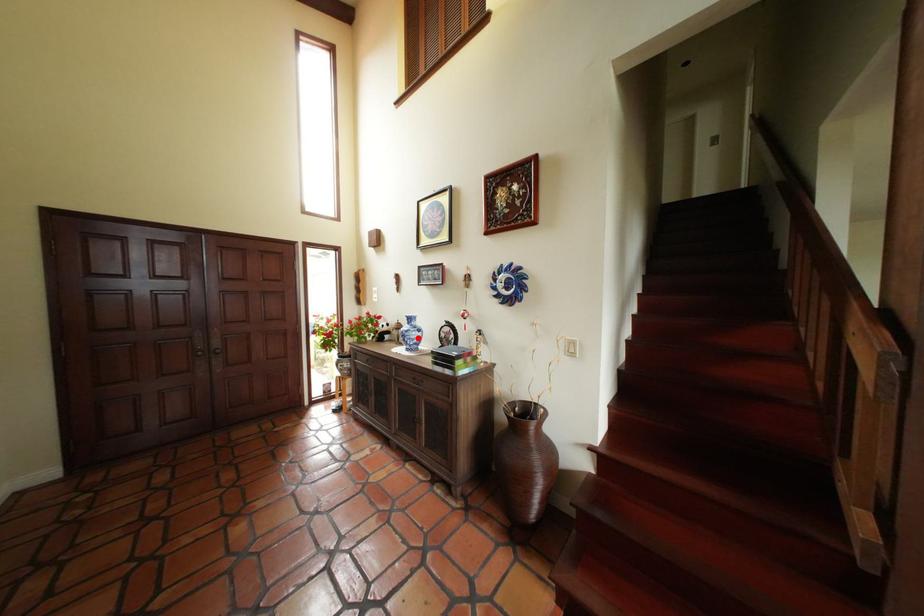
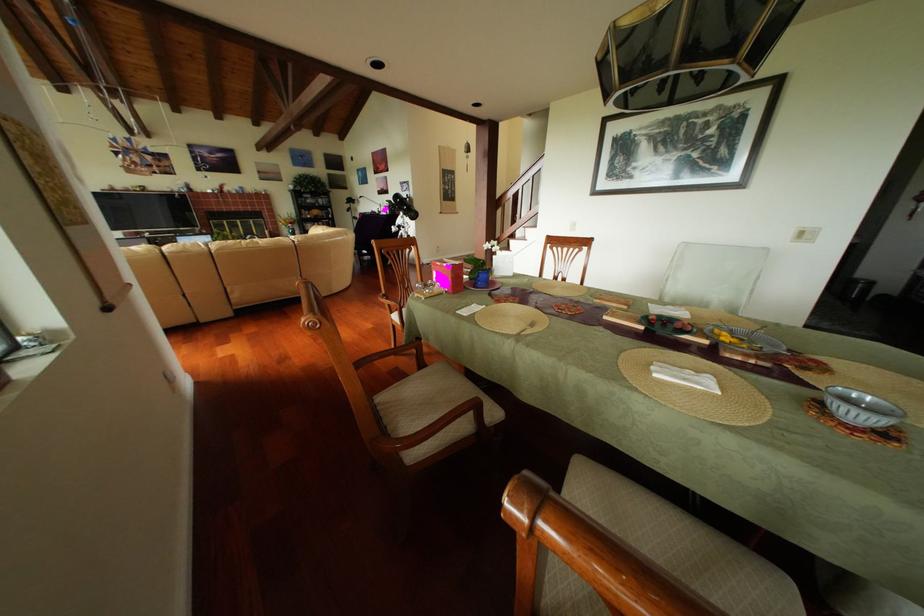
Question: I am providing you with two images of the same scene from different viewpoints. A red point is marked on the first image. Is the red point's position out of view in image 2?

Choices:
 (A) Yes
 (B) No

Answer: (A)